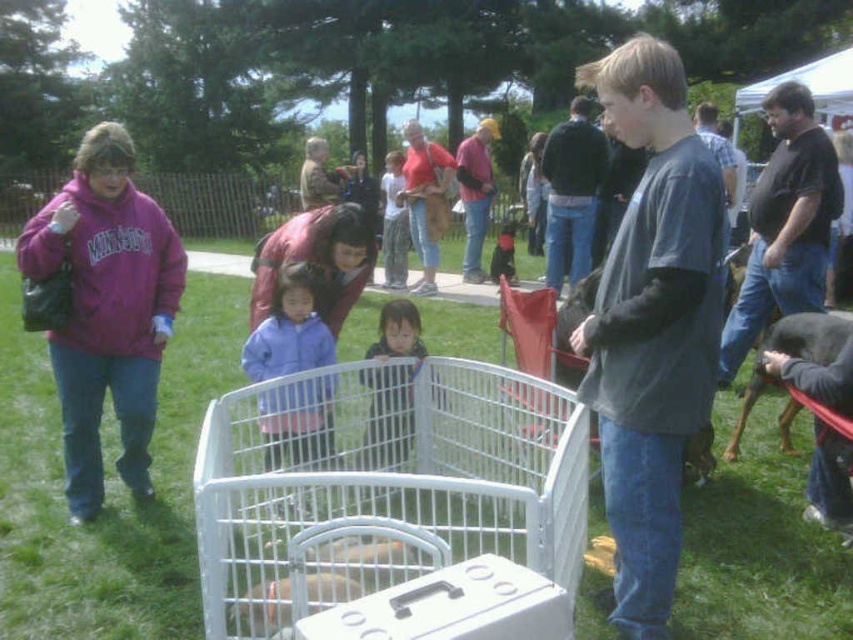
You are standing at the point labeled point [277,280] and want to walk to the point labeled point [399,365]. Which direction should you move to get closer to your destination?

You should move away from the camera since point [399,365] is further from the camera than point [277,280].

You are standing at the center of the park and see a purple fleece jacket at center. Where is the purple fleece jacket located relative to the point marked at coordinates point (289, 330)?

The purple fleece jacket at center is exactly at the point marked at coordinates point (289, 330).